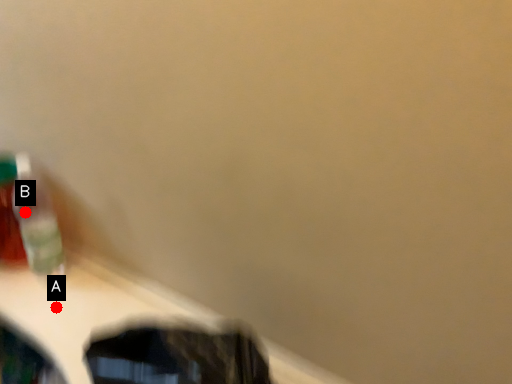
Question: Two points are circled on the image, labeled by A and B beside each circle. Among these points, which one is nearest to the camera?

Choices:
 (A) A is closer
 (B) B is closer

Answer: (A)